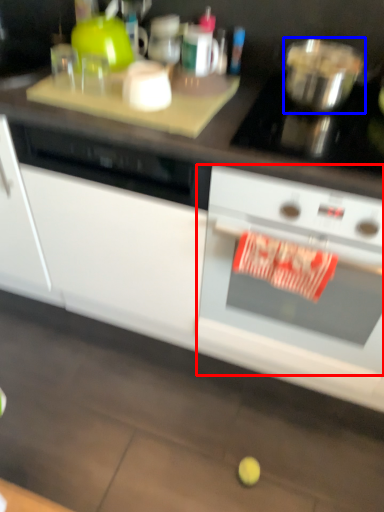
Question: Among these objects, which one is farthest to the camera, kitchen appliance (highlighted by a red box) or bowl (highlighted by a blue box)?

Choices:
 (A) kitchen appliance
 (B) bowl

Answer: (B)